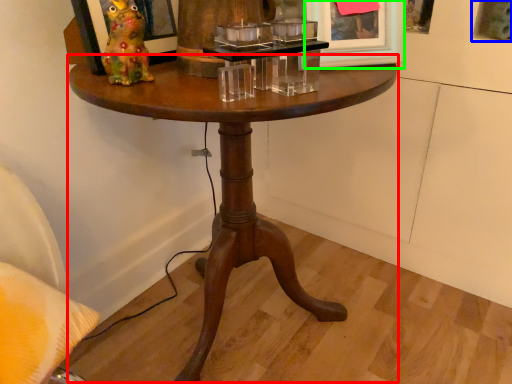
Question: Which object is positioned farthest from coffee table (highlighted by a red box)? Select from picture frame (highlighted by a blue box) and picture frame (highlighted by a green box).

Choices:
 (A) picture frame
 (B) picture frame

Answer: (A)